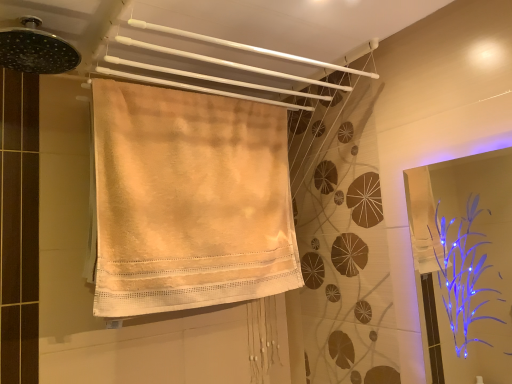
Question: Is transparent plastic screen door at right completely or partially inside beige cotton towel at center, the second towel positioned from the top?

Choices:
 (A) no
 (B) yes

Answer: (A)

Question: Is beige cotton towel at center, marked as the 1th towel in a bottom-to-top arrangement, far from transparent plastic screen door at right?

Choices:
 (A) no
 (B) yes

Answer: (B)

Question: Can you confirm if beige cotton towel at center, marked as the 1th towel in a bottom-to-top arrangement, is shorter than transparent plastic screen door at right?

Choices:
 (A) no
 (B) yes

Answer: (A)

Question: Is beige cotton towel at center, marked as the 1th towel in a bottom-to-top arrangement, thinner than transparent plastic screen door at right?

Choices:
 (A) yes
 (B) no

Answer: (B)

Question: Does beige cotton towel at center, the second towel positioned from the top, have a greater height compared to transparent plastic screen door at right?

Choices:
 (A) yes
 (B) no

Answer: (A)

Question: Can you confirm if beige cotton towel at center, marked as the 1th towel in a bottom-to-top arrangement, is wider than transparent plastic screen door at right?

Choices:
 (A) yes
 (B) no

Answer: (A)

Question: Can you confirm if beige cotton towel at upper center, positioned as the 1th towel in top-to-bottom order, is positioned to the left of beige cotton towel at center, the second towel positioned from the top?

Choices:
 (A) no
 (B) yes

Answer: (A)

Question: From a real-world perspective, is beige cotton towel at upper center, which is the second towel in bottom-to-top order, positioned under beige cotton towel at center, the second towel positioned from the top, based on gravity?

Choices:
 (A) yes
 (B) no

Answer: (B)

Question: Is beige cotton towel at upper center, which is the second towel in bottom-to-top order, wider than beige cotton towel at center, marked as the 1th towel in a bottom-to-top arrangement?

Choices:
 (A) yes
 (B) no

Answer: (A)

Question: Does beige cotton towel at upper center, positioned as the 1th towel in top-to-bottom order, have a lesser height compared to beige cotton towel at center, marked as the 1th towel in a bottom-to-top arrangement?

Choices:
 (A) no
 (B) yes

Answer: (B)

Question: Is beige cotton towel at upper center, which is the second towel in bottom-to-top order, thinner than beige cotton towel at center, marked as the 1th towel in a bottom-to-top arrangement?

Choices:
 (A) yes
 (B) no

Answer: (B)

Question: Can beige cotton towel at center, marked as the 1th towel in a bottom-to-top arrangement, be found inside beige cotton towel at upper center, positioned as the 1th towel in top-to-bottom order?

Choices:
 (A) no
 (B) yes

Answer: (A)

Question: From the image's perspective, is black metallic shower head at upper left on beige cotton towel at upper center, which is the second towel in bottom-to-top order?

Choices:
 (A) no
 (B) yes

Answer: (B)